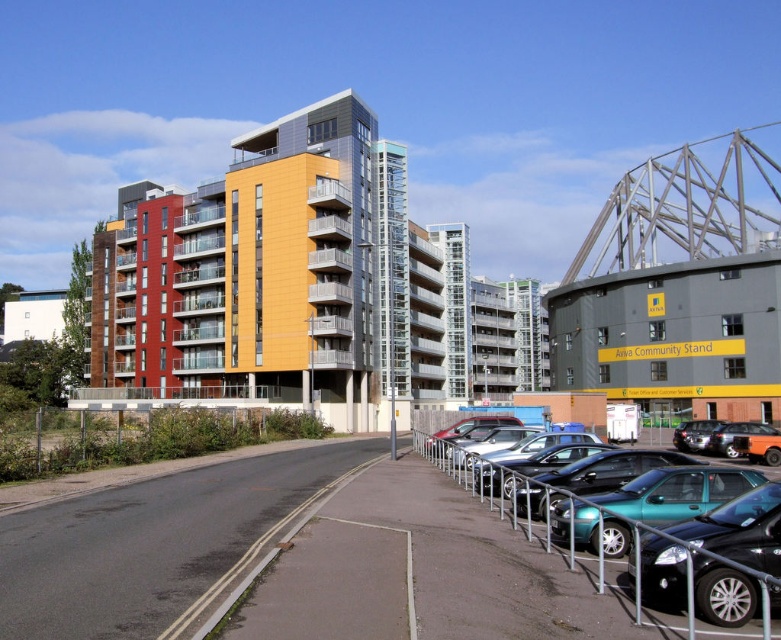
Can you confirm if teal metallic car at center is positioned to the left of shiny black sedan at center?

Indeed, teal metallic car at center is positioned on the left side of shiny black sedan at center.

Who is taller, teal metallic car at center or shiny black sedan at center?

shiny black sedan at center

Describe the element at coordinates (662, 497) in the screenshot. I see `teal metallic car at center` at that location.

Locate an element on the screen. The height and width of the screenshot is (640, 781). teal metallic car at center is located at coordinates (662, 497).

Who is taller, metallic gray parking lot at center or shiny black sedan at center?

shiny black sedan at center

Between metallic gray parking lot at center and shiny black sedan at center, which one appears on the right side from the viewer's perspective?

shiny black sedan at center

Is point (270, 596) closer to viewer compared to point (697, 440)?

Yes.

What are the coordinates of `metallic gray parking lot at center` in the screenshot? It's located at [x=293, y=557].

Consider the image. Is shiny black car at lower right taller than metallic silver car at center?

No, shiny black car at lower right is not taller than metallic silver car at center.

Which is below, shiny black car at lower right or metallic silver car at center?

metallic silver car at center is below.

Is point (747, 541) positioned in front of point (439, 432)?

Yes, point (747, 541) is closer to viewer.

Identify the location of shiny black car at lower right. (740, 529).